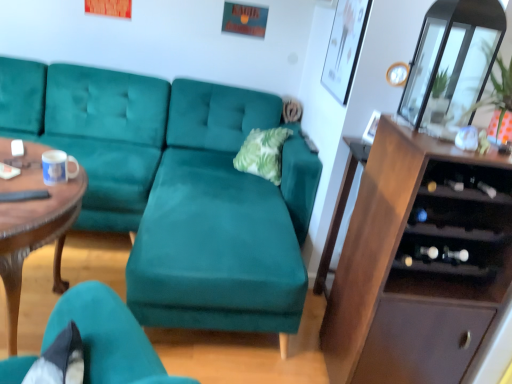
Locate an element on the screen. The width and height of the screenshot is (512, 384). teal velvet couch at center is located at coordinates (176, 186).

The image size is (512, 384). What do you see at coordinates (57, 167) in the screenshot?
I see `white glossy mug at center` at bounding box center [57, 167].

Image resolution: width=512 pixels, height=384 pixels. Identify the location of transparent glass door at upper right. (452, 61).

From the picture: Is transparent glass door at upper right closer to the viewer compared to teal velvet couch at center?

That is True.

Considering the sizes of objects transparent glass door at upper right and teal velvet couch at center in the image provided, who is taller, transparent glass door at upper right or teal velvet couch at center?

Standing taller between the two is teal velvet couch at center.

Based on the photo, can you confirm if transparent glass door at upper right is wider than teal velvet couch at center?

No, transparent glass door at upper right is not wider than teal velvet couch at center.

Who is smaller, transparent glass door at upper right or teal velvet couch at center?

Smaller between the two is transparent glass door at upper right.

Is transparent glass door at upper right further to the viewer compared to brown wood cabinet at right?

Yes, it is.

From the image's perspective, which one is positioned higher, transparent glass door at upper right or brown wood cabinet at right?

transparent glass door at upper right is shown above in the image.

This screenshot has height=384, width=512. In order to click on glass door that appears above the brown wood cabinet at right (from the image's perspective) in this screenshot , I will do `click(452, 61)`.

Is teal velvet couch at center spatially inside transparent glass door at upper right, or outside of it?

teal velvet couch at center cannot be found inside transparent glass door at upper right.

Is teal velvet couch at center positioned behind transparent glass door at upper right?

Yes, it is behind transparent glass door at upper right.

From the image's perspective, which one is positioned lower, teal velvet couch at center or transparent glass door at upper right?

teal velvet couch at center, from the image's perspective.

From a real-world perspective, does teal velvet couch at center sit lower than transparent glass door at upper right?

Yes, from a real-world perspective, teal velvet couch at center is beneath transparent glass door at upper right.

From the image's perspective, is teal velvet couch at center positioned above or below brown wood cabinet at right?

teal velvet couch at center is above brown wood cabinet at right.

From a real-world perspective, is teal velvet couch at center below brown wood cabinet at right?

Indeed, from a real-world perspective, teal velvet couch at center is positioned beneath brown wood cabinet at right.

Is teal velvet couch at center located outside brown wood cabinet at right?

That's correct, teal velvet couch at center is outside of brown wood cabinet at right.

Consider the image. Considering their positions, is teal velvet couch at center located in front of or behind brown wood cabinet at right?

Visually, teal velvet couch at center is located behind brown wood cabinet at right.

Which object is further away from the camera, teal velvet couch at center or white glossy mug at center?

Positioned behind is white glossy mug at center.

This screenshot has width=512, height=384. Identify the location of studio couch on the right of white glossy mug at center. (176, 186).

Is white glossy mug at center at the back of teal velvet couch at center?

No, teal velvet couch at center is not facing the opposite direction of white glossy mug at center.

Between point (39, 82) and point (60, 159), which one is positioned behind?

The point (39, 82) is farther.

Can you confirm if wooden polished coffee table at left is bigger than brown wood cabinet at right?

Indeed, wooden polished coffee table at left has a larger size compared to brown wood cabinet at right.

Can you confirm if wooden polished coffee table at left is wider than brown wood cabinet at right?

Correct, the width of wooden polished coffee table at left exceeds that of brown wood cabinet at right.

Is white glossy mug at center located outside wooden polished coffee table at left?

white glossy mug at center lies outside wooden polished coffee table at left's area.

Which of these two, white glossy mug at center or wooden polished coffee table at left, is thinner?

With smaller width is white glossy mug at center.

What's the angular difference between white glossy mug at center and wooden polished coffee table at left's facing directions?

63.6 degrees separate the facing orientations of white glossy mug at center and wooden polished coffee table at left.

Is point (51, 159) closer to viewer compared to point (11, 183)?

No.

Find the location of a particular element. This screenshot has height=384, width=512. studio couch below the transparent glass door at upper right (from the image's perspective) is located at coordinates (176, 186).

The image size is (512, 384). I want to click on cabinetry located on the left of transparent glass door at upper right, so click(419, 262).

Which object lies nearer to the anchor point teal velvet couch at center, wooden polished coffee table at left or transparent glass door at upper right?

Based on the image, wooden polished coffee table at left appears to be nearer to teal velvet couch at center.

Considering their positions, is wooden polished coffee table at left positioned further to brown wood cabinet at right than transparent glass door at upper right?

wooden polished coffee table at left.

From the image, which object appears to be farther from teal velvet couch at center, brown wood cabinet at right or wooden polished coffee table at left?

Based on the image, brown wood cabinet at right appears to be further to teal velvet couch at center.

Looking at this image, looking at the image, which one is located further to brown wood cabinet at right, transparent glass door at upper right or wooden polished coffee table at left?

The object further to brown wood cabinet at right is wooden polished coffee table at left.

Based on their spatial positions, is brown wood cabinet at right or white glossy mug at center further from teal velvet couch at center?

Based on the image, white glossy mug at center appears to be further to teal velvet couch at center.

Which object lies further to the anchor point transparent glass door at upper right, teal velvet couch at center or brown wood cabinet at right?

teal velvet couch at center.

Looking at the image, which one is located closer to teal velvet couch at center, white glossy mug at center or wooden polished coffee table at left?

Among the two, wooden polished coffee table at left is located nearer to teal velvet couch at center.

When comparing their distances from wooden polished coffee table at left, does brown wood cabinet at right or transparent glass door at upper right seem further?

transparent glass door at upper right lies further to wooden polished coffee table at left than the other object.

Where is `studio couch between wooden polished coffee table at left and white glossy mug at center along the z-axis`? The image size is (512, 384). studio couch between wooden polished coffee table at left and white glossy mug at center along the z-axis is located at coordinates (176, 186).

This screenshot has height=384, width=512. I want to click on studio couch located between white glossy mug at center and transparent glass door at upper right in the left-right direction, so click(176, 186).

Where is `cabinetry located between wooden polished coffee table at left and transparent glass door at upper right in the left-right direction`? This screenshot has height=384, width=512. cabinetry located between wooden polished coffee table at left and transparent glass door at upper right in the left-right direction is located at coordinates (419, 262).

Locate an element on the screen. This screenshot has height=384, width=512. studio couch located between white glossy mug at center and brown wood cabinet at right in the left-right direction is located at coordinates (176, 186).